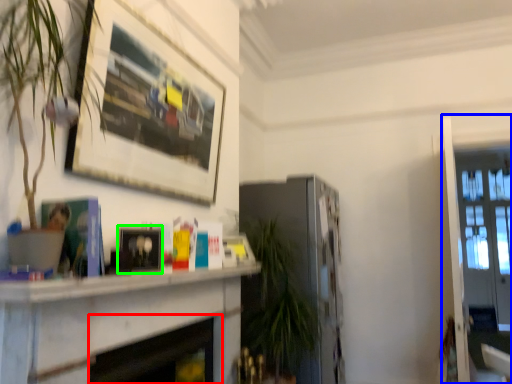
Question: Considering the real-world distances, which object is closest to fireplace (highlighted by a red box)? glass door (highlighted by a blue box) or picture frame (highlighted by a green box).

Choices:
 (A) glass door
 (B) picture frame

Answer: (B)